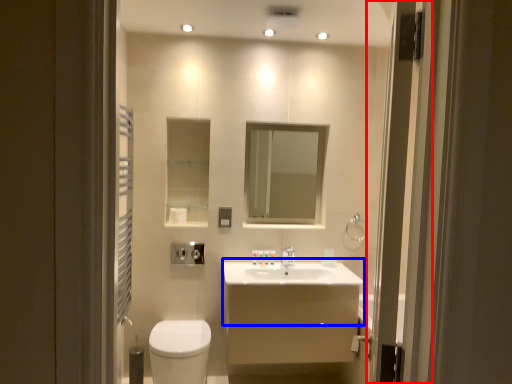
Question: Which object appears closest to the camera in this image, screen door (highlighted by a red box) or counter top (highlighted by a blue box)?

Choices:
 (A) screen door
 (B) counter top

Answer: (A)